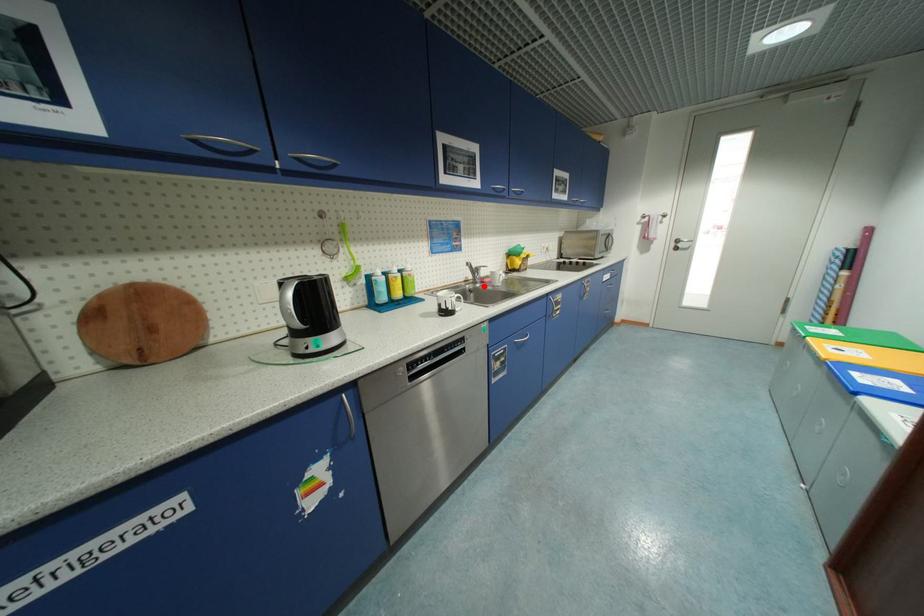
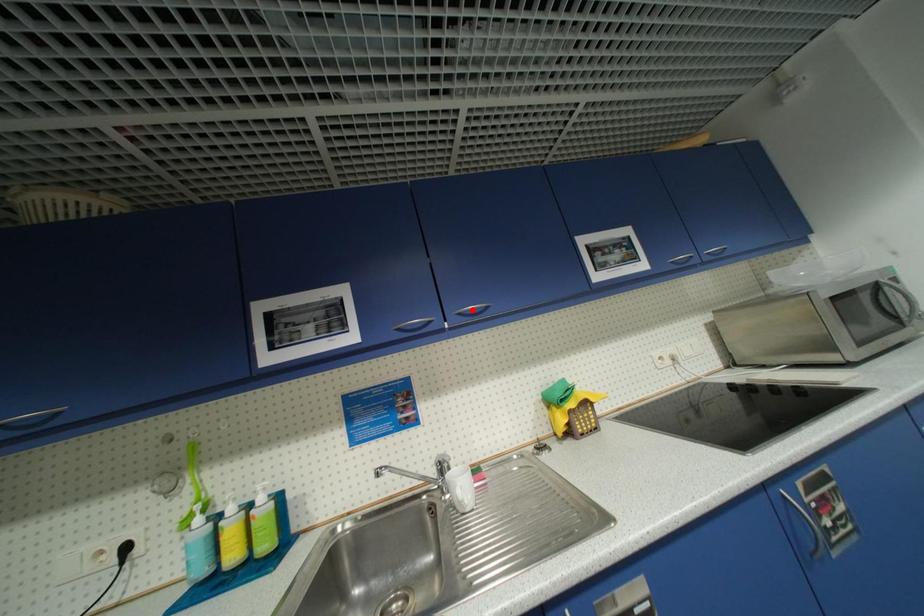
I am providing you with two images of the same scene from different viewpoints. A red point is marked on the first image and another point is marked on the second image. Are the points marked in image1 and image2 representing the same 3D position?

No